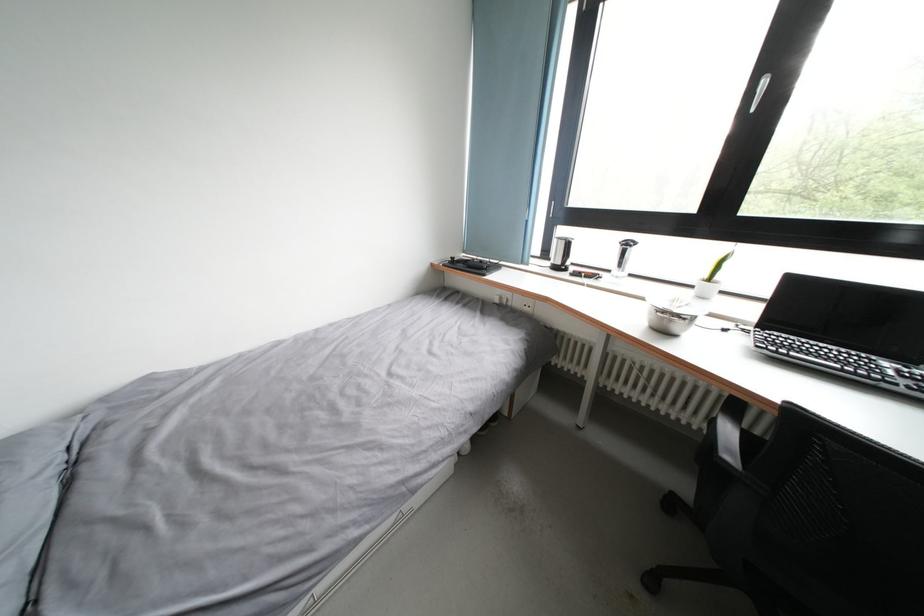
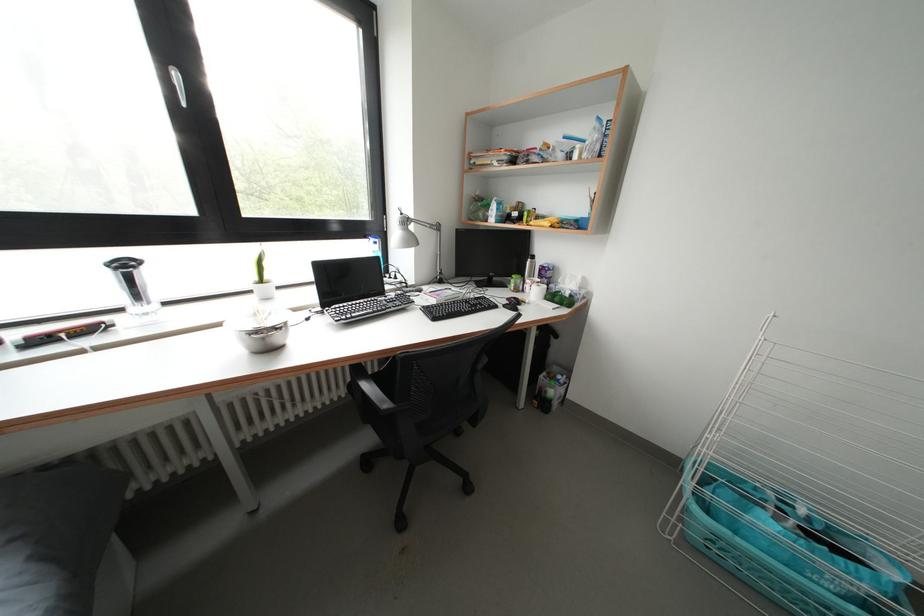
Find the pixel in the second image that matches point (670, 317) in the first image.

(262, 337)